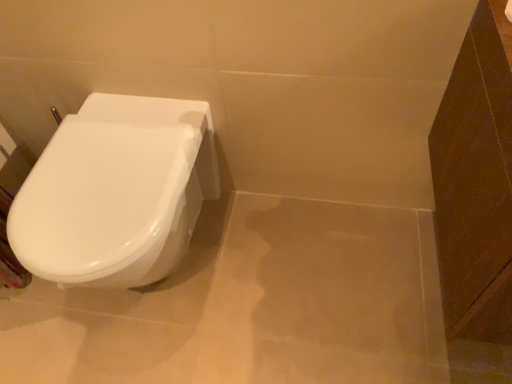
Image resolution: width=512 pixels, height=384 pixels. I want to click on white glossy toilet at left, so click(x=108, y=204).

The width and height of the screenshot is (512, 384). What do you see at coordinates (108, 204) in the screenshot? I see `white glossy toilet at left` at bounding box center [108, 204].

Where is `white glossy toilet at left`? white glossy toilet at left is located at coordinates (108, 204).